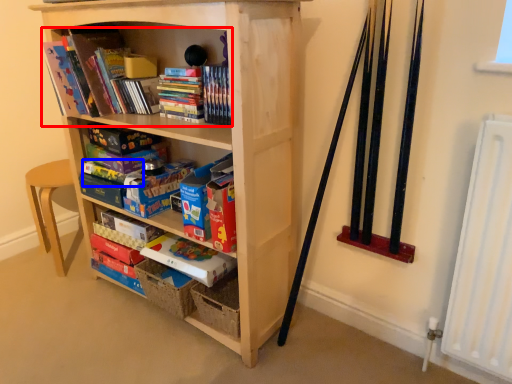
Question: Which object is closer to the camera taking this photo, book (highlighted by a red box) or paperback book (highlighted by a blue box)?

Choices:
 (A) book
 (B) paperback book

Answer: (A)